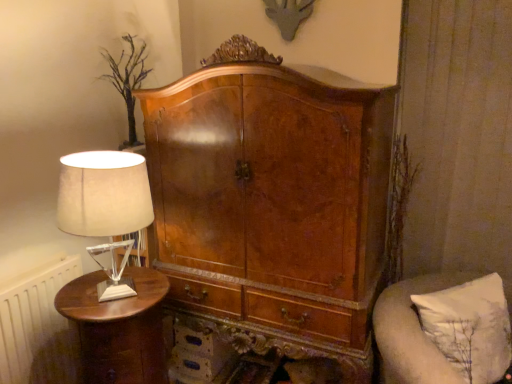
Question: From a real-world perspective, is shiny brown wood nightstand at left under white fabric lampshade at left?

Choices:
 (A) yes
 (B) no

Answer: (A)

Question: Does shiny brown wood nightstand at left have a lesser width compared to white fabric lampshade at left?

Choices:
 (A) no
 (B) yes

Answer: (A)

Question: Is shiny brown wood nightstand at left at the left side of white fabric lampshade at left?

Choices:
 (A) no
 (B) yes

Answer: (B)

Question: Is shiny brown wood nightstand at left shorter than white fabric lampshade at left?

Choices:
 (A) no
 (B) yes

Answer: (A)

Question: Is shiny brown wood nightstand at left turned away from white fabric lampshade at left?

Choices:
 (A) no
 (B) yes

Answer: (A)

Question: Would you say shiny brown wood nightstand at left is to the left or to the right of white painted radiator at left in the picture?

Choices:
 (A) right
 (B) left

Answer: (A)

Question: Considering their positions, is shiny brown wood nightstand at left located in front of or behind white painted radiator at left?

Choices:
 (A) front
 (B) behind

Answer: (A)

Question: From a real-world perspective, is shiny brown wood nightstand at left above or below white painted radiator at left?

Choices:
 (A) below
 (B) above

Answer: (A)

Question: Do you think shiny brown wood nightstand at left is within white painted radiator at left, or outside of it?

Choices:
 (A) outside
 (B) inside

Answer: (A)

Question: Relative to white fabric pillow at right, is shiny brown wood nightstand at left in front or behind?

Choices:
 (A) front
 (B) behind

Answer: (B)

Question: From a real-world perspective, relative to white fabric pillow at right, is shiny brown wood nightstand at left vertically above or below?

Choices:
 (A) above
 (B) below

Answer: (B)

Question: Based on their positions, is shiny brown wood nightstand at left located to the left or right of white fabric pillow at right?

Choices:
 (A) right
 (B) left

Answer: (B)

Question: Considering the positions of shiny brown wood nightstand at left and white fabric pillow at right in the image, is shiny brown wood nightstand at left wider or thinner than white fabric pillow at right?

Choices:
 (A) thin
 (B) wide

Answer: (B)

Question: Considering the positions of white fabric pillow at right and white painted radiator at left in the image, is white fabric pillow at right wider or thinner than white painted radiator at left?

Choices:
 (A) wide
 (B) thin

Answer: (A)

Question: In the image, is white fabric pillow at right on the left side or the right side of white painted radiator at left?

Choices:
 (A) left
 (B) right

Answer: (B)